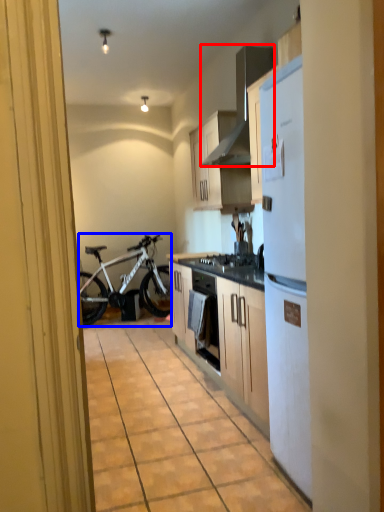
Question: Among these objects, which one is farthest to the camera, appliance (highlighted by a red box) or bicycle (highlighted by a blue box)?

Choices:
 (A) appliance
 (B) bicycle

Answer: (B)